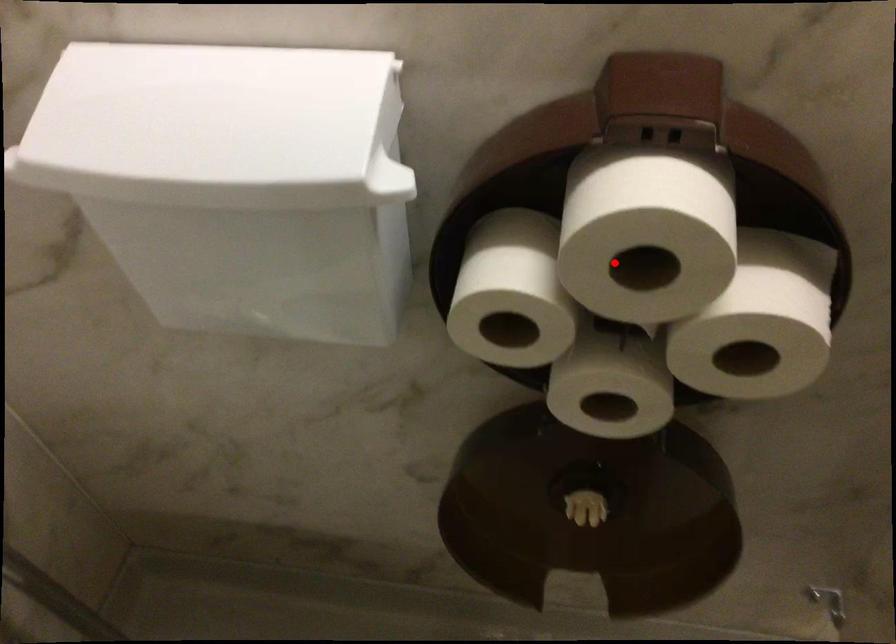
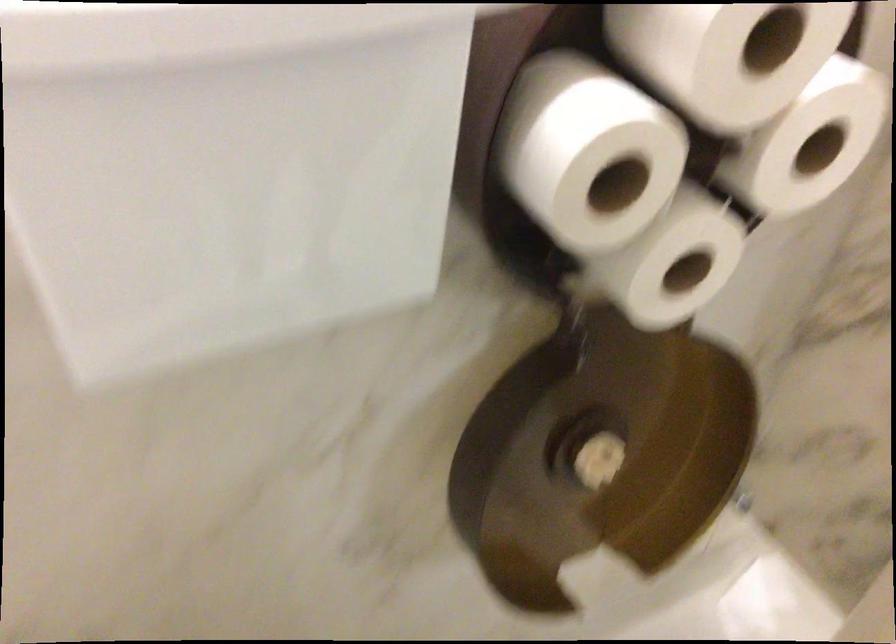
Question: I am providing you with two images of the same scene from different viewpoints. A red point is shown in image1. For the corresponding object point in image2, is it positioned nearer or farther from the camera?

Choices:
 (A) Nearer
 (B) Farther

Answer: (A)